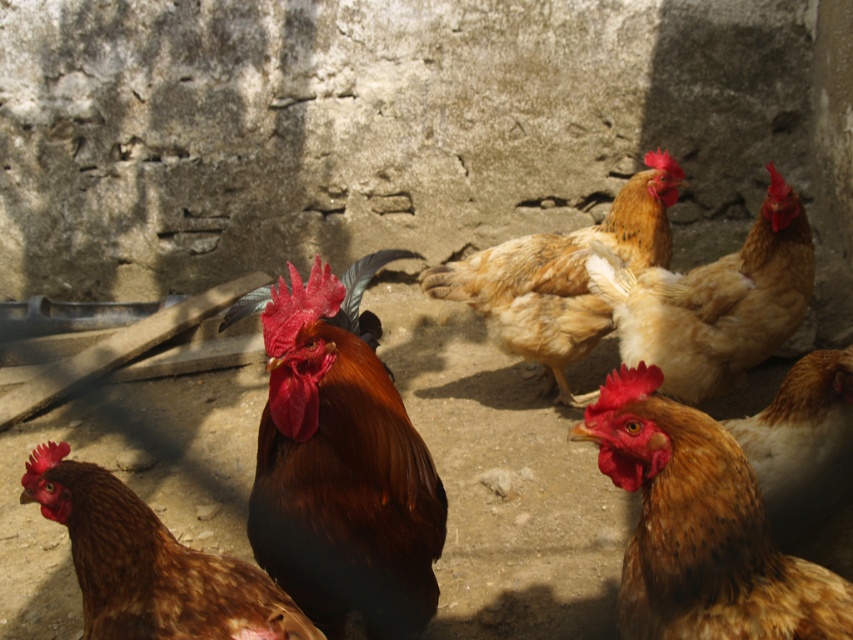
Is brown speckled feather at lower left smaller than brown speckled feathers at center?

Actually, brown speckled feather at lower left might be larger than brown speckled feathers at center.

Locate an element on the screen. The height and width of the screenshot is (640, 853). brown speckled feather at lower left is located at coordinates (149, 564).

Locate an element on the screen. brown speckled feather at lower left is located at coordinates (149, 564).

Identify the location of brown speckled feather at lower left. (149, 564).

Looking at this image, who is lower down, brown speckled feather at lower left or golden feathered rooster at center?

Positioned lower is brown speckled feather at lower left.

The image size is (853, 640). What are the coordinates of `brown speckled feather at lower left` in the screenshot? It's located at (149, 564).

Does brown feathered rooster at center appear over golden feathered chicken at center?

Incorrect, brown feathered rooster at center is not positioned above golden feathered chicken at center.

Between brown feathered rooster at center and golden feathered chicken at center, which one appears on the left side from the viewer's perspective?

brown feathered rooster at center

Where is `brown feathered rooster at center`? The width and height of the screenshot is (853, 640). brown feathered rooster at center is located at coordinates (700, 528).

Where is `brown feathered rooster at center`? brown feathered rooster at center is located at coordinates (700, 528).